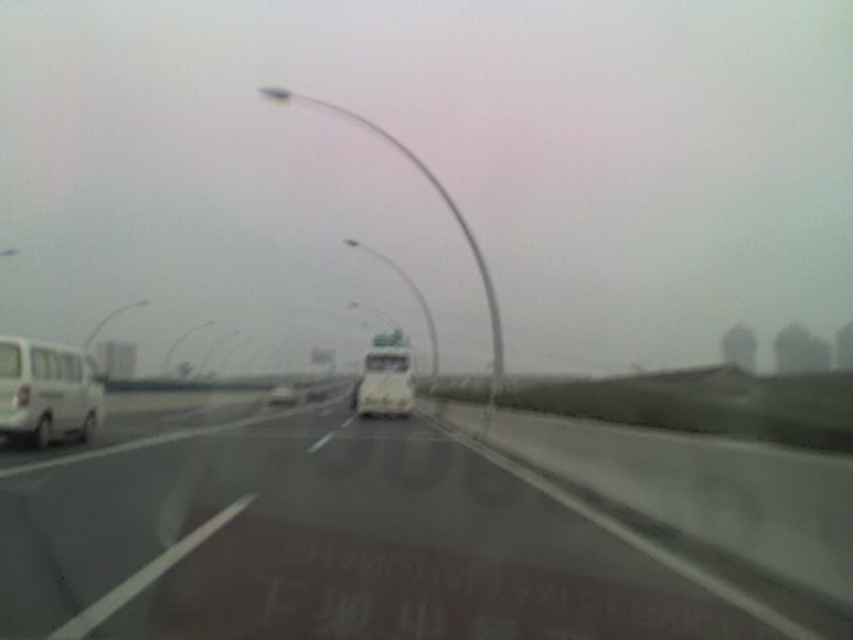
Question: Based on their relative distances, which object is nearer to the white matte van at center?

Choices:
 (A) white matte bus at center
 (B) white glossy highway at center
 (C) white matte van at left

Answer: (A)

Question: Which of these objects is positioned closest to the white glossy highway at center?

Choices:
 (A) white matte van at center
 (B) white matte bus at center
 (C) white matte van at left

Answer: (C)

Question: Among these objects, which one is nearest to the camera?

Choices:
 (A) white glossy highway at center
 (B) white matte bus at center
 (C) white matte van at left

Answer: (A)

Question: Can you confirm if white matte bus at center is bigger than white matte van at center?

Choices:
 (A) yes
 (B) no

Answer: (B)

Question: Is white glossy highway at center below white matte van at center?

Choices:
 (A) no
 (B) yes

Answer: (A)

Question: Is white matte bus at center closer to camera compared to white matte van at center?

Choices:
 (A) no
 (B) yes

Answer: (B)